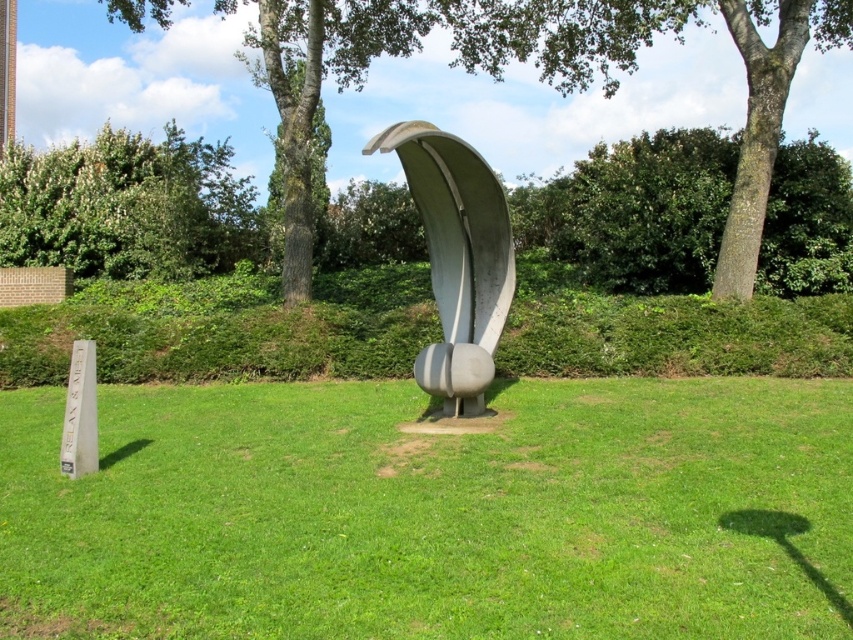
Locate an element on the screen. This screenshot has width=853, height=640. green grass at center is located at coordinates (434, 513).

Which is in front, point (541, 467) or point (51, 234)?

Point (541, 467) is in front.

Between point (756, 483) and point (4, 180), which one is positioned behind?

Positioned behind is point (4, 180).

Where is `green grass at center`? green grass at center is located at coordinates (434, 513).

Does green grass at center have a smaller size compared to satin gray sculpture at center?

No, green grass at center is not smaller than satin gray sculpture at center.

At what (x,y) coordinates should I click in order to perform the action: click on green grass at center. Please return your answer as a coordinate pair (x, y). This screenshot has height=640, width=853. Looking at the image, I should click on point(434,513).

Where is `green grass at center`? The height and width of the screenshot is (640, 853). green grass at center is located at coordinates (434, 513).

How far apart are green leafy tree at upper left and satin gray sculpture at center?

green leafy tree at upper left is 12.81 meters away from satin gray sculpture at center.

Which is in front, point (73, 179) or point (491, 276)?

Positioned in front is point (491, 276).

Where is `green leafy tree at upper left`? Image resolution: width=853 pixels, height=640 pixels. green leafy tree at upper left is located at coordinates (126, 205).